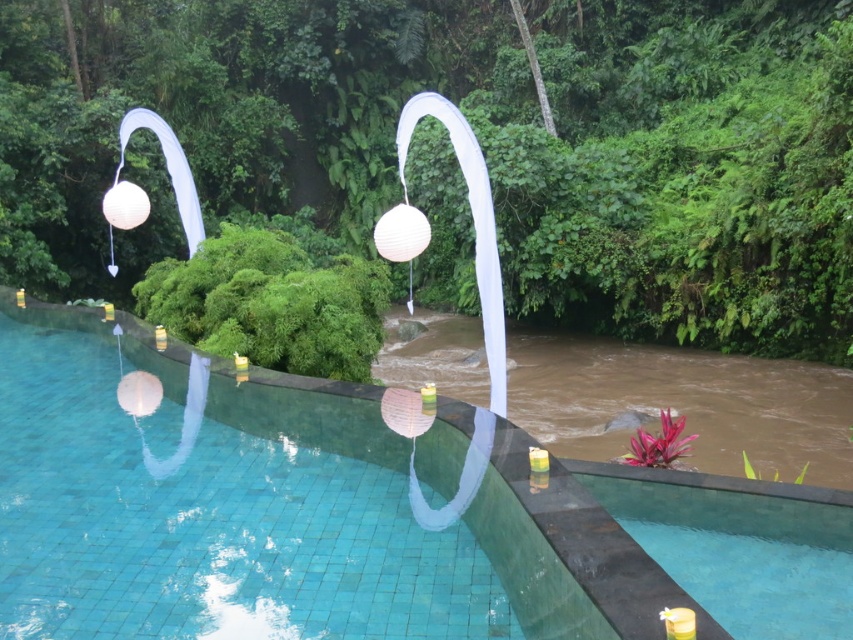
You are standing at the edge of the transparent glass pool at center and want to see the green leafy tree at upper center. Can you see the entire tree without moving your head?

The green leafy tree at upper center is wider than the transparent glass pool at center, so you might not be able to see the entire tree without moving your head since its width exceeds that of the pool.

From the picture: You are standing at the edge of the transparent glass pool at center and want to see the green leafy tree at upper center. Can you see the top of the tree from your current position?

The green leafy tree at upper center is taller than the transparent glass pool at center, so yes, you can see the top of the green leafy tree at upper center from your position at the edge of the transparent glass pool at center.

You are standing at the edge of the pool and want to place a new decorative item. You have two options to choose from. The first option is a large statue that needs to be placed at point (x=463, y=6). The second option is a floating flower arrangement that needs to be placed at point (x=711, y=518). Considering the depth of the pool at these points, which placement would be safer for swimmers?

Placing the floating flower arrangement at point (x=711, y=518) is safer for swimmers because point (x=463, y=6) is closer to the camera, meaning it is shallower. The deeper point (x=711, y=518) would allow the flower arrangement to float safely without posing a tripping hazard for swimmers.